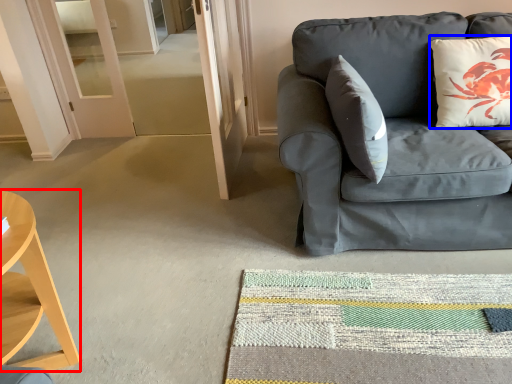
Question: Which of the following is the farthest to the observer, desk (highlighted by a red box) or pillow (highlighted by a blue box)?

Choices:
 (A) desk
 (B) pillow

Answer: (B)